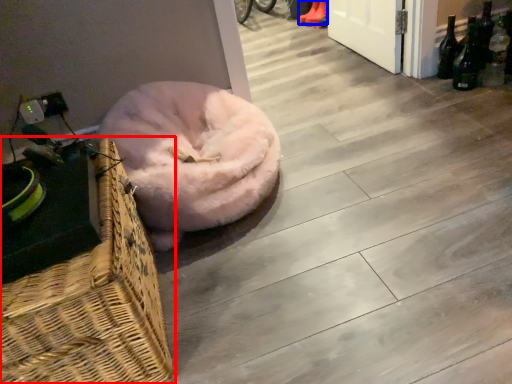
Question: Which object is further to the camera taking this photo, picnic basket (highlighted by a red box) or footwear (highlighted by a blue box)?

Choices:
 (A) picnic basket
 (B) footwear

Answer: (B)